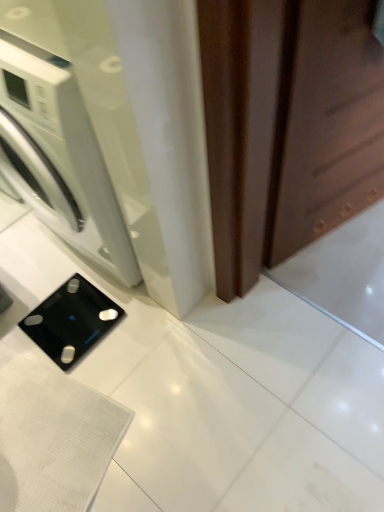
Question: Is brown matte screen door at right not close to black glass scale at lower left?

Choices:
 (A) no
 (B) yes

Answer: (A)

Question: Considering the relative sizes of brown matte screen door at right and black glass scale at lower left in the image provided, is brown matte screen door at right thinner than black glass scale at lower left?

Choices:
 (A) yes
 (B) no

Answer: (A)

Question: From the image's perspective, is brown matte screen door at right beneath black glass scale at lower left?

Choices:
 (A) yes
 (B) no

Answer: (B)

Question: Does brown matte screen door at right appear on the right side of black glass scale at lower left?

Choices:
 (A) yes
 (B) no

Answer: (A)

Question: Can you confirm if brown matte screen door at right is positioned to the left of black glass scale at lower left?

Choices:
 (A) no
 (B) yes

Answer: (A)

Question: From their relative heights in the image, would you say black glass scale at lower left is taller or shorter than white glossy washing machine at left?

Choices:
 (A) tall
 (B) short

Answer: (B)

Question: From the image's perspective, is black glass scale at lower left above or below white glossy washing machine at left?

Choices:
 (A) below
 (B) above

Answer: (A)

Question: Looking at their shapes, would you say black glass scale at lower left is wider or thinner than white glossy washing machine at left?

Choices:
 (A) wide
 (B) thin

Answer: (B)

Question: From a real-world perspective, is black glass scale at lower left above or below white glossy washing machine at left?

Choices:
 (A) below
 (B) above

Answer: (A)

Question: From the image's perspective, is black glass scale at lower left positioned above or below brown matte screen door at right?

Choices:
 (A) above
 (B) below

Answer: (B)

Question: From a real-world perspective, is black glass scale at lower left positioned above or below brown matte screen door at right?

Choices:
 (A) above
 (B) below

Answer: (B)

Question: Considering their positions, is black glass scale at lower left located in front of or behind brown matte screen door at right?

Choices:
 (A) front
 (B) behind

Answer: (B)

Question: Is black glass scale at lower left taller or shorter than brown matte screen door at right?

Choices:
 (A) short
 (B) tall

Answer: (A)

Question: Considering their positions, is white glossy washing machine at left located in front of or behind brown matte screen door at right?

Choices:
 (A) front
 (B) behind

Answer: (B)

Question: In the image, is white glossy washing machine at left on the left side or the right side of brown matte screen door at right?

Choices:
 (A) left
 (B) right

Answer: (A)